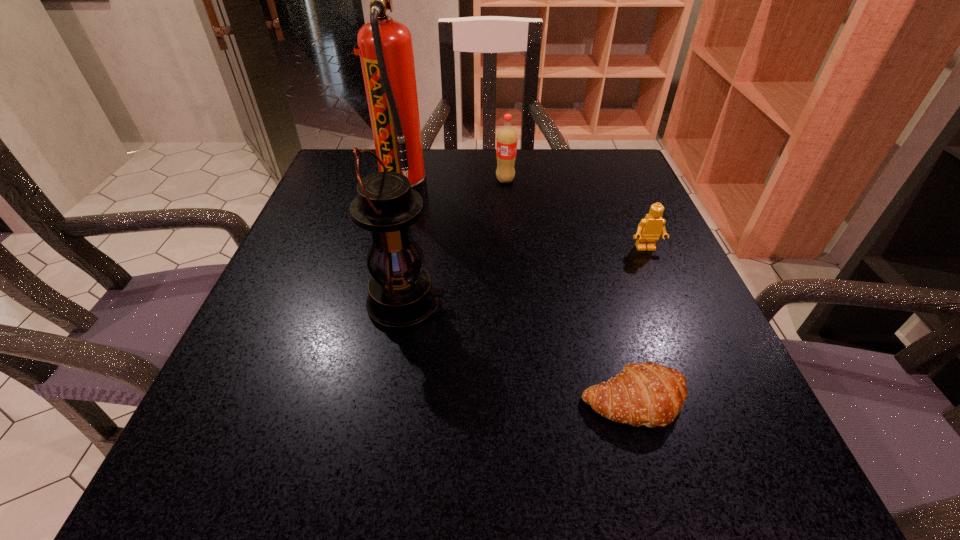
Where is `the tallest object`? This screenshot has height=540, width=960. the tallest object is located at coordinates (385, 47).

Find the location of a particular element. The width and height of the screenshot is (960, 540). lantern is located at coordinates (401, 296).

Where is `the fourth shortest object`? the fourth shortest object is located at coordinates (401, 296).

At what (x,y) coordinates should I click in order to perform the action: click on the third tallest object. Please return your answer as a coordinate pair (x, y). The image size is (960, 540). Looking at the image, I should click on (506, 142).

What are the coordinates of `the third object from right to left` in the screenshot? It's located at (x=506, y=142).

You are a GUI agent. You are given a task and a screenshot of the screen. Output one action in this format:
    pyautogui.click(x=<x>, y=<y>)
    Task: Click on the Lego
    The height and width of the screenshot is (540, 960).
    Given the screenshot: What is the action you would take?
    pyautogui.click(x=650, y=228)

You are a GUI agent. You are given a task and a screenshot of the screen. Output one action in this format:
    pyautogui.click(x=<x>, y=<y>)
    Task: Click on the third farthest object
    
    Given the screenshot: What is the action you would take?
    tap(650, 228)

Find the location of `the nearest object`. the nearest object is located at coordinates (648, 394).

Identify the location of the shortest object. (648, 394).

Find the location of a particular element. The width and height of the screenshot is (960, 540). vacant space located 0.380m with the nozzle pointing from the back of the tallest object is located at coordinates [x=597, y=192].